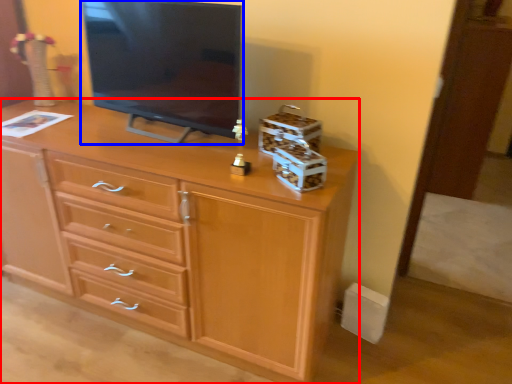
Question: Which object appears farthest to the camera in this image, chest of drawers (highlighted by a red box) or television (highlighted by a blue box)?

Choices:
 (A) chest of drawers
 (B) television

Answer: (B)